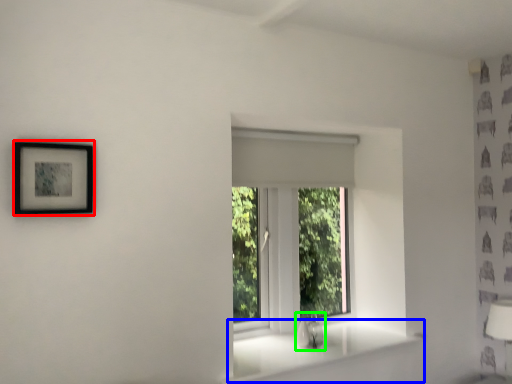
Question: Which object is the closest to the picture frame (highlighted by a red box)? Choose among these: window sill (highlighted by a blue box) or sink (highlighted by a green box).

Choices:
 (A) window sill
 (B) sink

Answer: (A)